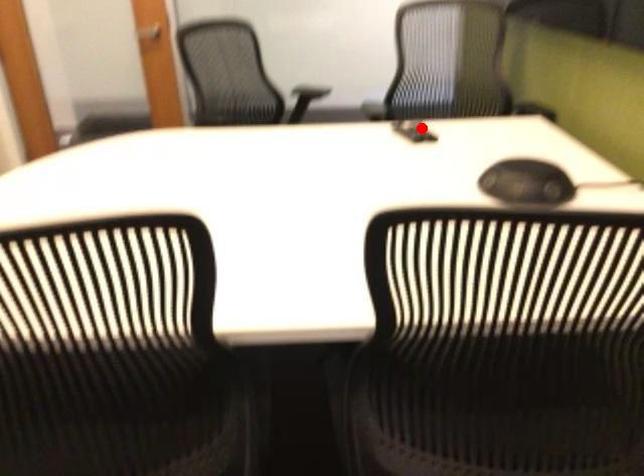
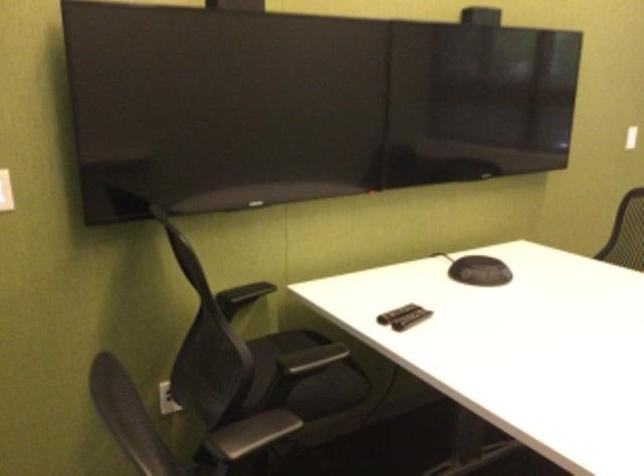
The point at the highlighted location is marked in the first image. Where is the corresponding point in the second image?

(395, 313)